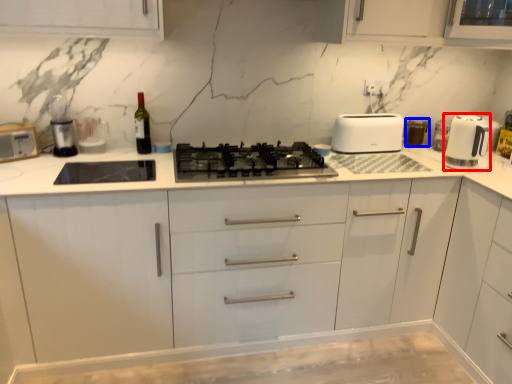
Question: Which point is closer to the camera, home appliance (highlighted by a red box) or appliance (highlighted by a blue box)?

Choices:
 (A) home appliance
 (B) appliance

Answer: (A)